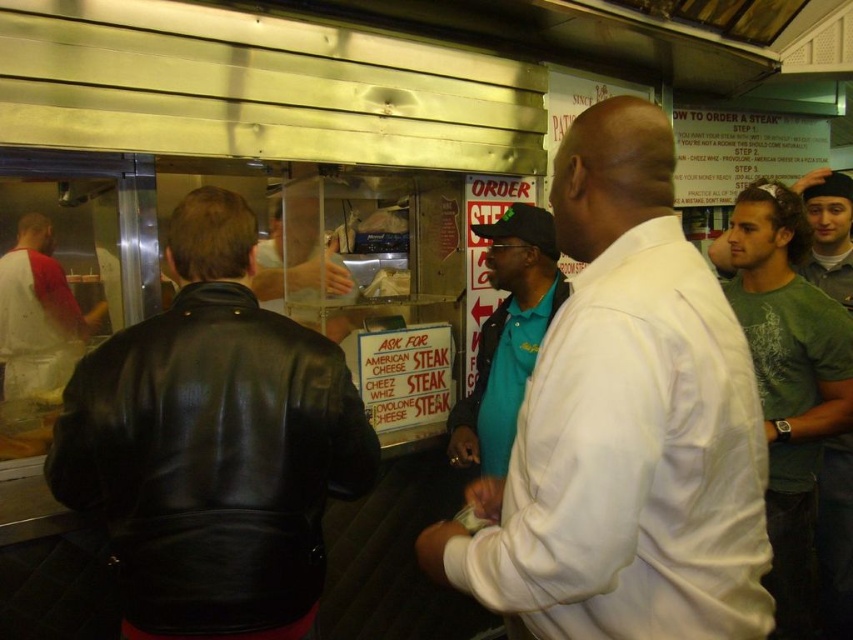
Question: Which of the following is the closest to the observer?

Choices:
 (A) white matte shirt at center
 (B) green knit cap at upper right
 (C) white matte shirt at left

Answer: (A)

Question: Among these points, which one is nearest to the camera?

Choices:
 (A) (811, 262)
 (B) (51, 486)

Answer: (B)

Question: Is green t-shirt at right to the left of green knit cap at upper right from the viewer's perspective?

Choices:
 (A) yes
 (B) no

Answer: (A)

Question: Can you confirm if white matte shirt at center is bigger than green t-shirt at right?

Choices:
 (A) yes
 (B) no

Answer: (A)

Question: Estimate the real-world distances between objects in this image. Which object is closer to the white matte shirt at center?

Choices:
 (A) black leather jacket at left
 (B) green knit cap at upper right

Answer: (A)

Question: Can you confirm if white matte shirt at center is positioned below black leather jacket at left?

Choices:
 (A) yes
 (B) no

Answer: (B)